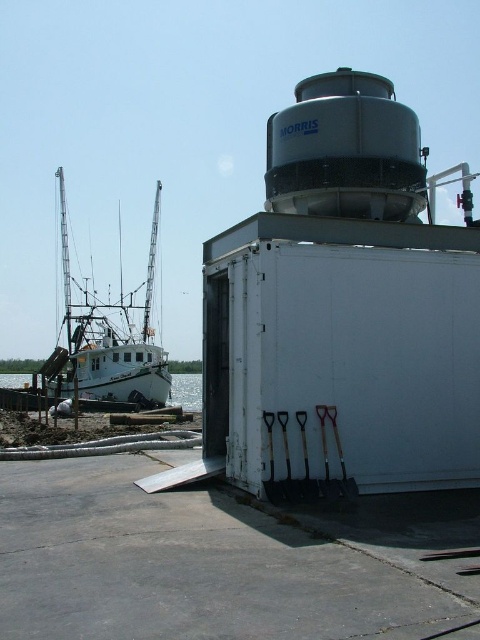
You are standing at the center of the dock and see a point marked at coordinates (107,340). What object is located at that point?

The white matte boat at left is located at point (107,340).

You are standing on the dock and see the white matte boat at left and the white glossy water at lower left. Which object is closer to you?

The white matte boat at left is closer to you because it is positioned in front of the white glossy water at lower left.

You are a dock worker who needs to move a heavy crate from the white building with the cylindrical AC unit labeled MORRIS to the white matte boat at left. The crane you have can lift items up to 30 meters. Will the crane be able to reach the boat?

The distance between the white building with the cylindrical AC unit labeled MORRIS and the white matte boat at left is 28.17 meters. Since the crane can lift up to 30 meters, it will be able to reach the boat.